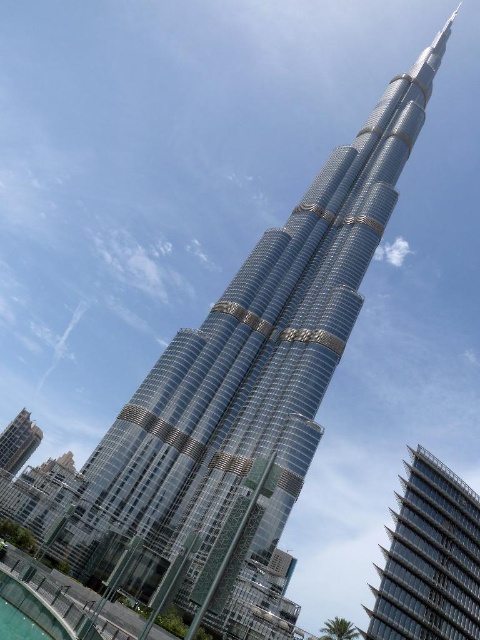
You are standing at the base of the Burj Khalifa and notice the clear glass pool at lower left and the glassy metallic building at lower left. Which object is closer to you?

The clear glass pool at lower left is closer to you since it is positioned over the glassy metallic building at lower left, indicating it is in front.

You are standing in front of the Burj Khalifa and want to take a photo that includes both the glassy metallic skyscraper at right and the glassy metallic building at lower left. Which of the two buildings should you position closer to the camera to ensure both are fully visible in the frame?

You should position the glassy metallic building at lower left closer to the camera since it has a greater width than the glassy metallic skyscraper at right, allowing it to occupy more space in the frame while still including the narrower skyscraper in the background.

Consider the image. You are standing in front of the Burj Khalifa and want to determine the relative positions of two points marked on the building. The first point is at coordinates point(459, 499) and the second is at point(19, 444). Which point is closer to you?

Point(459, 499) is closer to the viewer than point(19, 444).